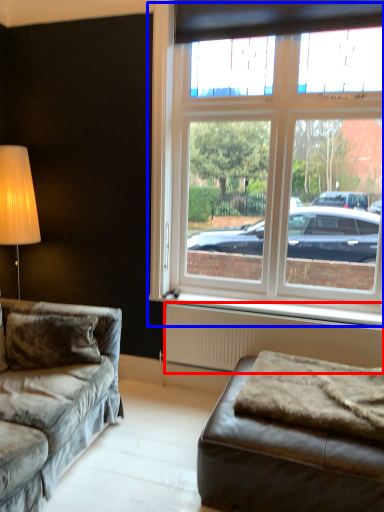
Question: Which point is further to the camera, radiator (highlighted by a red box) or window (highlighted by a blue box)?

Choices:
 (A) radiator
 (B) window

Answer: (A)